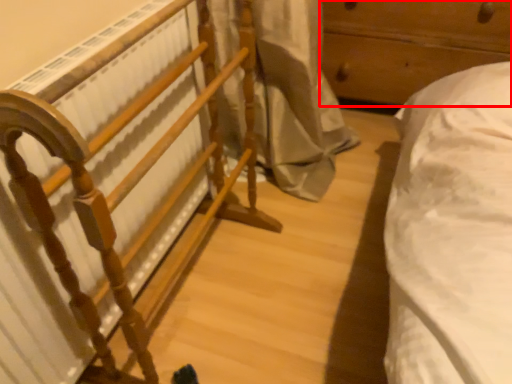
Question: Observing the image, what is the correct spatial positioning of furniture (annotated by the red box) in reference to furniture?

Choices:
 (A) right
 (B) left

Answer: (A)